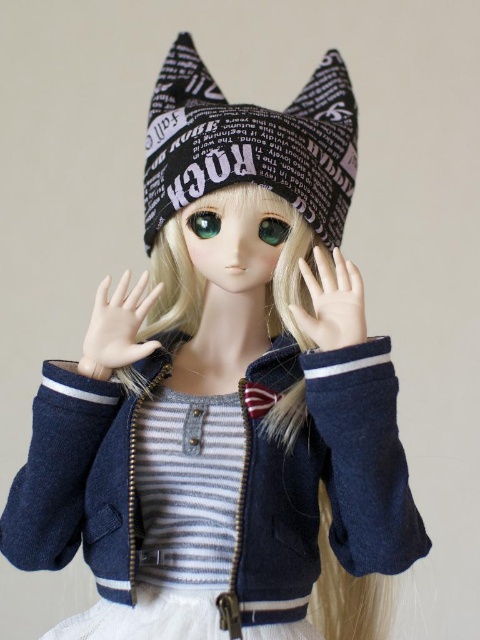
Question: Which object appears closest to the camera in this image?

Choices:
 (A) smooth skin hand at center
 (B) black printed fabric hat at center

Answer: (A)

Question: Is the position of smooth skin hand at center more distant than that of green glossy eye at center?

Choices:
 (A) no
 (B) yes

Answer: (A)

Question: Which point is farther from the camera taking this photo?

Choices:
 (A) (214, 225)
 (B) (295, 106)
 (C) (122, 317)
 (D) (320, 333)

Answer: (B)

Question: Which point is farther from the camera taking this photo?

Choices:
 (A) (240, 173)
 (B) (216, 230)
 (C) (324, 264)
 (D) (99, 358)

Answer: (B)

Question: Does smooth porcelain hand at center have a larger size compared to green glossy eye at center?

Choices:
 (A) yes
 (B) no

Answer: (A)

Question: Is black printed fabric hat at center closer to camera compared to smooth porcelain hand at center?

Choices:
 (A) yes
 (B) no

Answer: (B)